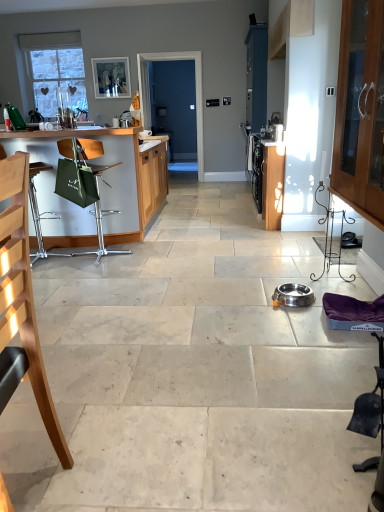
Question: Is green fabric chair at left, placed as the first chair when sorted from back to front, inside the boundaries of wooden cabinet with glass doors at right, or outside?

Choices:
 (A) outside
 (B) inside

Answer: (A)

Question: Is green fabric chair at left, which ranks as the 2th chair in front-to-back order, to the left or to the right of wooden cabinet with glass doors at right in the image?

Choices:
 (A) right
 (B) left

Answer: (B)

Question: Considering the real-world distances, which object is closest to the blue glossy screen door at center?

Choices:
 (A) green fabric bag at left
 (B) metallic green bag at left
 (C) green fabric chair at left, placed as the first chair when sorted from back to front
 (D) black fabric swivel chair at lower right
 (E) stainless steel bowl at center

Answer: (B)

Question: Which is nearer to the matte white picture frame at upper center?

Choices:
 (A) blue glossy screen door at center
 (B) stainless steel bowl at center
 (C) black fabric swivel chair at lower right
 (D) green fabric chair at left, which ranks as the 2th chair in front-to-back order
 (E) green fabric bag at left

Answer: (A)